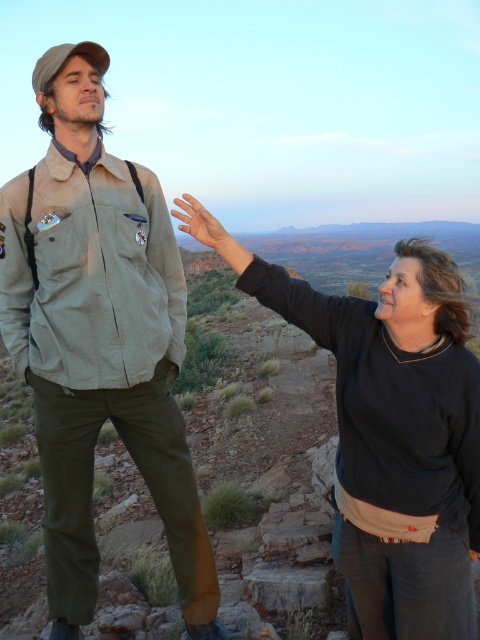
In the scene shown: You are a photographer trying to capture both the khaki fabric jacket at left and the matte skin hand at center in a single frame. Based on their sizes, which object should you focus on first to ensure both are in clear view?

The khaki fabric jacket at left is larger in size than the matte skin hand at center, so you should focus on the khaki fabric jacket at left first to ensure both are in clear view.